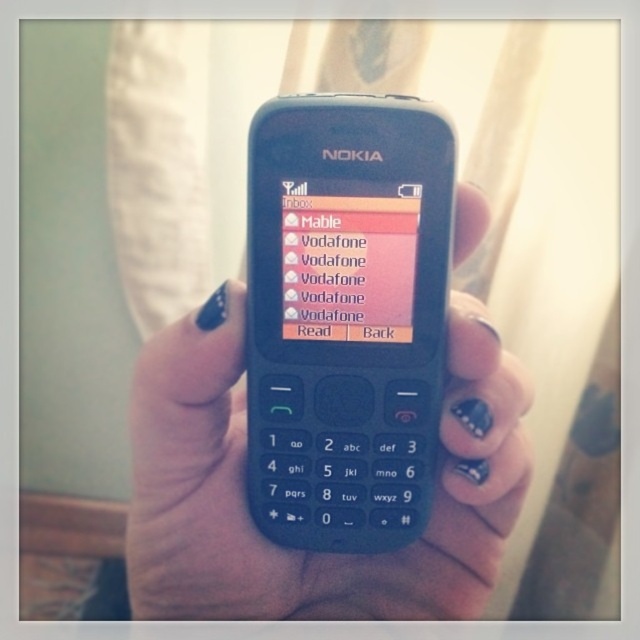
Locate an element on the screen. matte plastic nokia phone at center is located at coordinates (346, 316).

Between point (262, 189) and point (317, 243), which one is positioned in front?

Positioned in front is point (262, 189).

Who is more distant from viewer, (358, 548) or (392, 275)?

The point (358, 548) is behind.

This screenshot has width=640, height=640. Find the location of `matte plastic nokia phone at center`. matte plastic nokia phone at center is located at coordinates (346, 316).

How distant is matte plastic nokia phone at center from nail-polished skin at center?

They are 4.03 inches apart.

Locate an element on the screen. This screenshot has height=640, width=640. matte plastic nokia phone at center is located at coordinates (346, 316).

Identify the location of matte plastic nokia phone at center. (346, 316).

Looking at this image, is nail-polished skin at center bigger than pink glossy text message at center?

Indeed, nail-polished skin at center has a larger size compared to pink glossy text message at center.

The image size is (640, 640). Identify the location of nail-polished skin at center. (301, 552).

Identify the location of nail-polished skin at center. The width and height of the screenshot is (640, 640). (301, 552).